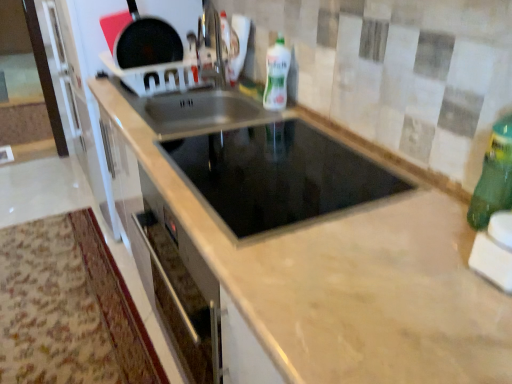
Question: Can you confirm if white glossy bottle at upper center, arranged as the 2th bottle when viewed from the front, is smaller than black glass cooktop at center?

Choices:
 (A) yes
 (B) no

Answer: (A)

Question: Can you confirm if white glossy bottle at upper center, the first bottle from the top, is positioned to the right of black glass cooktop at center?

Choices:
 (A) yes
 (B) no

Answer: (A)

Question: Considering the relative sizes of white glossy bottle at upper center, the 2th bottle from the right, and black glass cooktop at center in the image provided, is white glossy bottle at upper center, the 2th bottle from the right, taller than black glass cooktop at center?

Choices:
 (A) yes
 (B) no

Answer: (A)

Question: From a real-world perspective, is white glossy bottle at upper center, arranged as the 2th bottle when viewed from the front, beneath black glass cooktop at center?

Choices:
 (A) yes
 (B) no

Answer: (B)

Question: Would you say white glossy bottle at upper center, arranged as the 2th bottle when viewed from the front, contains black glass cooktop at center?

Choices:
 (A) no
 (B) yes

Answer: (A)

Question: Does white glossy bottle at upper center, the 2th bottle from the right, come behind black glass cooktop at center?

Choices:
 (A) no
 (B) yes

Answer: (B)

Question: Can you confirm if shiny black frying pan at upper left is bigger than black glass cooktop at center?

Choices:
 (A) no
 (B) yes

Answer: (A)

Question: Considering the relative sizes of shiny black frying pan at upper left and black glass cooktop at center in the image provided, is shiny black frying pan at upper left taller than black glass cooktop at center?

Choices:
 (A) yes
 (B) no

Answer: (A)

Question: Is shiny black frying pan at upper left facing away from black glass cooktop at center?

Choices:
 (A) no
 (B) yes

Answer: (A)

Question: Is shiny black frying pan at upper left completely or partially outside of black glass cooktop at center?

Choices:
 (A) no
 (B) yes

Answer: (B)

Question: Could black glass cooktop at center be considered to be inside shiny black frying pan at upper left?

Choices:
 (A) no
 (B) yes

Answer: (A)

Question: From a real-world perspective, is shiny black frying pan at upper left below black glass cooktop at center?

Choices:
 (A) yes
 (B) no

Answer: (B)

Question: Considering the relative sizes of white glossy bottle at upper center, marked as the first bottle in a back-to-front arrangement, and green plastic bottle at right, which appears as the 2th bottle when viewed from the left, in the image provided, is white glossy bottle at upper center, marked as the first bottle in a back-to-front arrangement, taller than green plastic bottle at right, which appears as the 2th bottle when viewed from the left,?

Choices:
 (A) yes
 (B) no

Answer: (B)